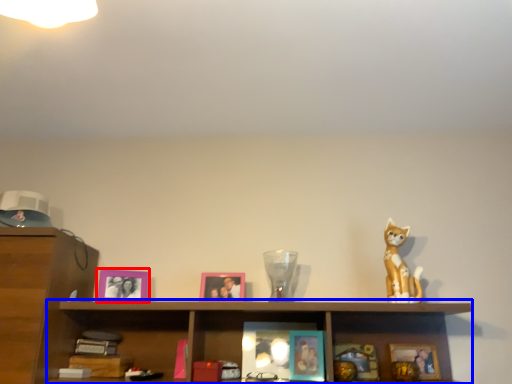
Question: Which point is further to the camera, picture frame (highlighted by a red box) or cabinet (highlighted by a blue box)?

Choices:
 (A) picture frame
 (B) cabinet

Answer: (A)